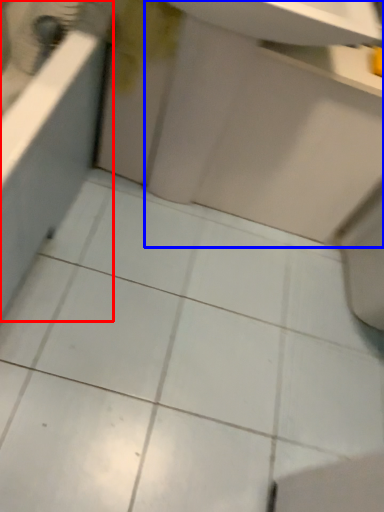
Question: Which object is closer to the camera taking this photo, bath (highlighted by a red box) or sink (highlighted by a blue box)?

Choices:
 (A) bath
 (B) sink

Answer: (A)